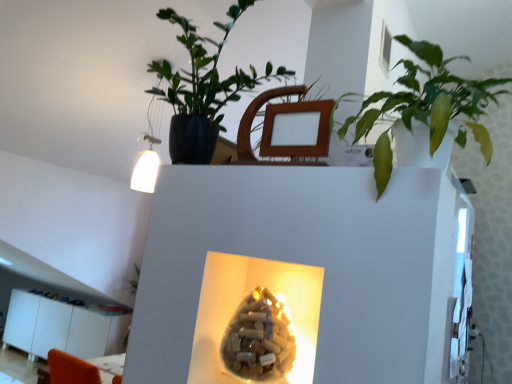
Question: From a real-world perspective, is green glossy leafy plant at upper right, marked as the second houseplant in a left-to-right arrangement, physically located above or below wooden swivel chair at upper center?

Choices:
 (A) above
 (B) below

Answer: (A)

Question: Is green glossy leafy plant at upper right, which is the first houseplant from right to left, wider or thinner than wooden swivel chair at upper center?

Choices:
 (A) thin
 (B) wide

Answer: (B)

Question: Which object is positioned farthest from the wooden swivel chair at upper center?

Choices:
 (A) green glossy leafy plant at upper right, marked as the second houseplant in a left-to-right arrangement
 (B) white glossy cabinet at lower left
 (C) matte black pot at upper center, which appears as the second houseplant when viewed from the right
 (D) translucent beige vase at center

Answer: (B)

Question: Which is nearer to the green glossy leafy plant at upper right, which is the first houseplant from right to left?

Choices:
 (A) wooden swivel chair at upper center
 (B) matte black pot at upper center, which appears as the second houseplant when viewed from the right
 (C) white glossy cabinet at lower left
 (D) translucent beige vase at center

Answer: (A)